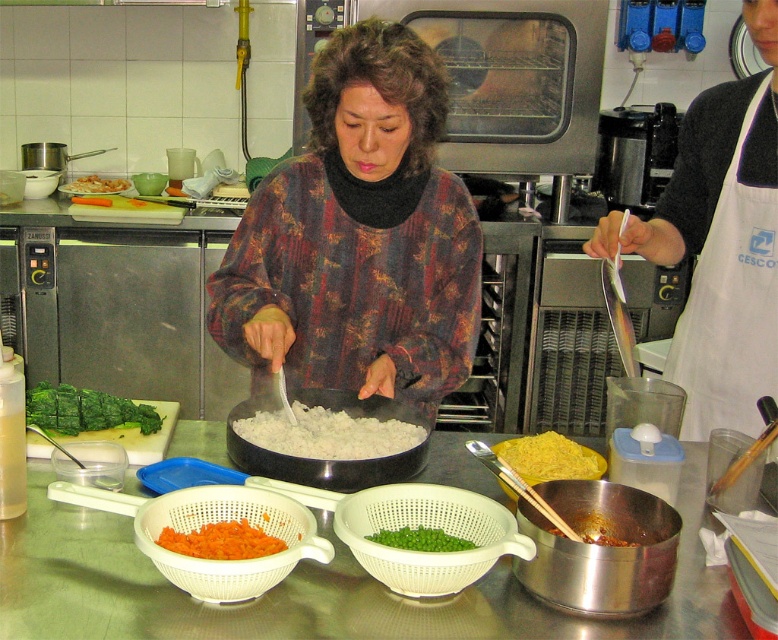
Question: Which of the following is the closest to the observer?

Choices:
 (A) white plastic colander at lower center
 (B) green leafy vegetable at center
 (C) yellow matte rice at center

Answer: (A)

Question: Can you confirm if white plastic colander at lower center is wider than white matte wok at center?

Choices:
 (A) no
 (B) yes

Answer: (A)

Question: Among these points, which one is nearest to the camera?

Choices:
 (A) (253, 365)
 (B) (335, 404)
 (C) (545, 461)

Answer: (C)

Question: Which of the following is the farthest from the observer?

Choices:
 (A) white matte bowl at center
 (B) green matte bowl at center

Answer: (B)

Question: Can you confirm if white fabric apron at right is positioned below green matte peas at center?

Choices:
 (A) no
 (B) yes

Answer: (A)

Question: Does yellow matte rice at center come in front of green matte bowl at center?

Choices:
 (A) no
 (B) yes

Answer: (B)